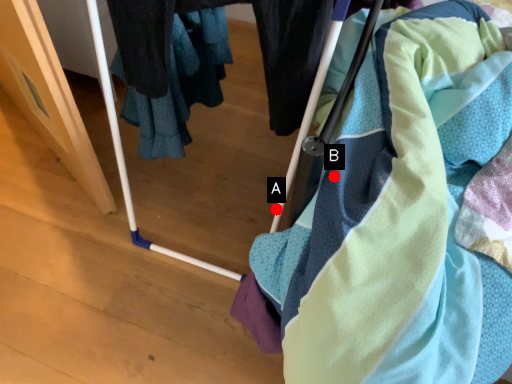
Question: Two points are circled on the image, labeled by A and B beside each circle. Which point appears closest to the camera in this image?

Choices:
 (A) A is closer
 (B) B is closer

Answer: (B)